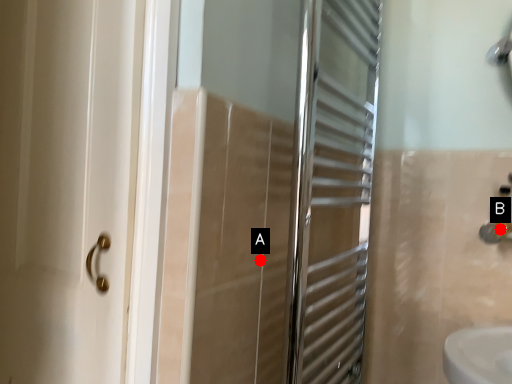
Question: Two points are circled on the image, labeled by A and B beside each circle. Which of the following is the closest to the observer?

Choices:
 (A) A is closer
 (B) B is closer

Answer: (A)